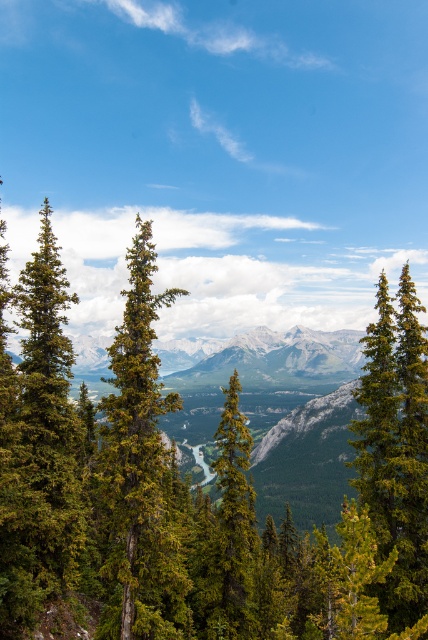
Does green textured pine tree at center have a lesser width compared to green matte tree at right?

Indeed, green textured pine tree at center has a lesser width compared to green matte tree at right.

The image size is (428, 640). What do you see at coordinates (140, 476) in the screenshot?
I see `green textured pine tree at center` at bounding box center [140, 476].

Is point (148, 401) less distant than point (379, 586)?

Yes, point (148, 401) is closer to viewer.

This screenshot has width=428, height=640. I want to click on green textured pine tree at center, so click(x=140, y=476).

Based on the photo, between green matte tree at right and green textured tree at center, which one has less height?

Standing shorter between the two is green textured tree at center.

The image size is (428, 640). I want to click on green matte tree at right, so click(395, 449).

This screenshot has width=428, height=640. What do you see at coordinates (395, 449) in the screenshot? I see `green matte tree at right` at bounding box center [395, 449].

Where is `green matte tree at right`? The image size is (428, 640). green matte tree at right is located at coordinates (395, 449).

Between green textured pine tree at center and green textured tree at center, which one has less height?

green textured tree at center is shorter.

Find the location of a particular element. green textured pine tree at center is located at coordinates (140, 476).

Locate an element on the screen. The width and height of the screenshot is (428, 640). green textured pine tree at center is located at coordinates (140, 476).